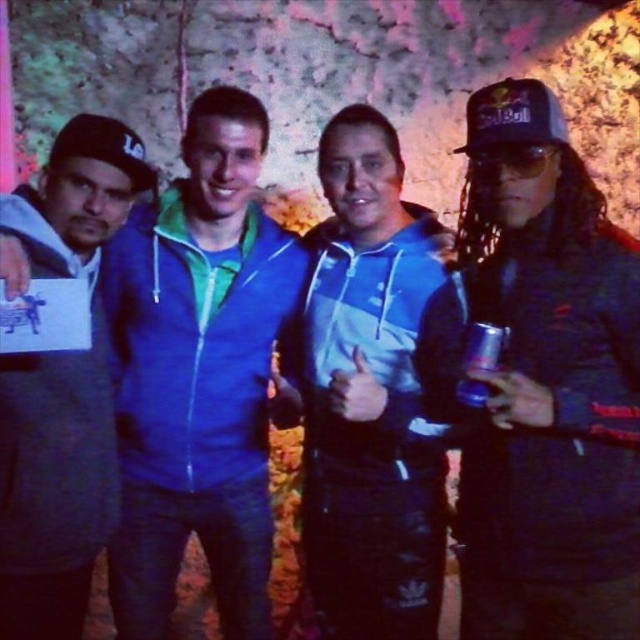
You are standing in front of a group photo setup. You need to place a 3.5 feet wide banner between you and the shiny black jacket at right. Is there enough space?

The distance between the viewer and the shiny black jacket at right is 4.35 feet. Since the banner is 3.5 feet wide, there is enough space to place it between you and the shiny black jacket at right as 3.5 is less than 4.35.